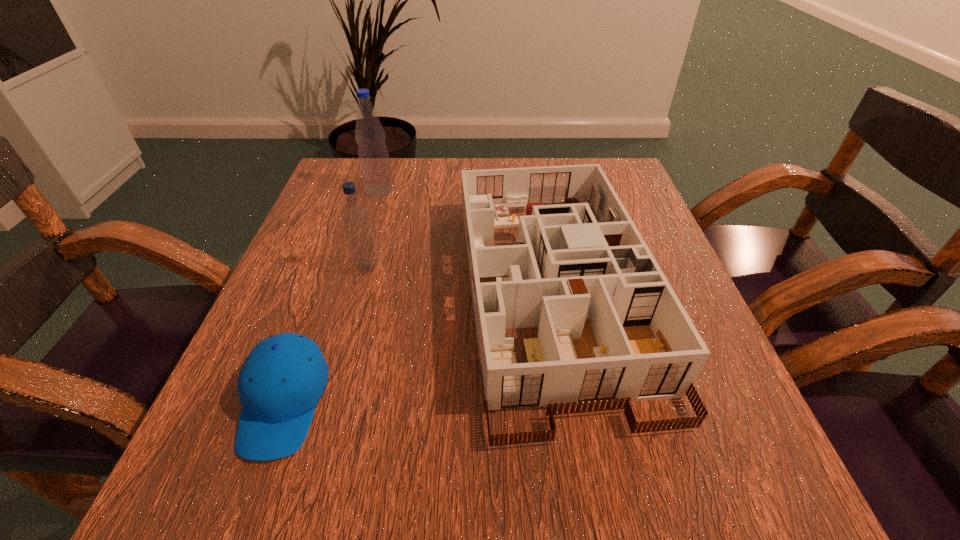
I want to click on vacant area that satisfies the following two spatial constraints: 1. on the front side of the nearer water bottle; 2. on the left side of the rightmost object, so click(361, 291).